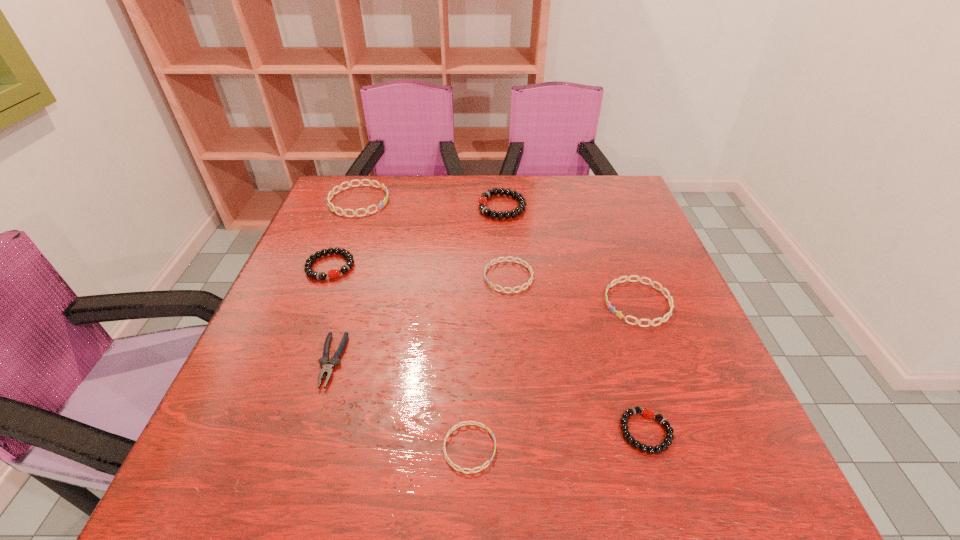
You are a GUI agent. You are given a task and a screenshot of the screen. Output one action in this format:
    pyautogui.click(x=<x>, y=<y>)
    Task: Click on the vacant region between the shortest object and the leftmost black bracelet
    The image size is (960, 540).
    Given the screenshot: What is the action you would take?
    pyautogui.click(x=400, y=357)

I want to click on free area in between the rightmost blue bracelet and the nearest black bracelet, so click(x=642, y=367).

Locate an element on the screen. vacant area that lies between the second smallest blue bracelet and the smallest blue bracelet is located at coordinates (489, 362).

The height and width of the screenshot is (540, 960). I want to click on blank region between the biggest black bracelet and the rightmost black bracelet, so click(x=574, y=319).

This screenshot has width=960, height=540. Identify the location of vacant area that lies between the second black bracelet from left to right and the third smallest blue bracelet. (570, 255).

Locate an element on the screen. object that stands as the third closest to the gray pliers is located at coordinates (513, 259).

Locate which object ranks seventh in proximity to the third nearest object. Please provide its 2D coordinates. Your answer should be formatted as a tuple, i.e. [(x, y)], where the tuple contains the x and y coordinates of a point satisfying the conditions above.

[(619, 314)]

Point out which bracelet is positioned as the nearest to the second smallest blue bracelet. Please provide its 2D coordinates. Your answer should be formatted as a tuple, i.e. [(x, y)], where the tuple contains the x and y coordinates of a point satisfying the conditions above.

[(619, 314)]

The height and width of the screenshot is (540, 960). Identify the location of bracelet that is the fifth closest to the leftmost blue bracelet. coord(456,426).

Identify which blue bracelet is the fourth closest to the smallest black bracelet. Please provide its 2D coordinates. Your answer should be formatted as a tuple, i.e. [(x, y)], where the tuple contains the x and y coordinates of a point satisfying the conditions above.

[(384, 188)]